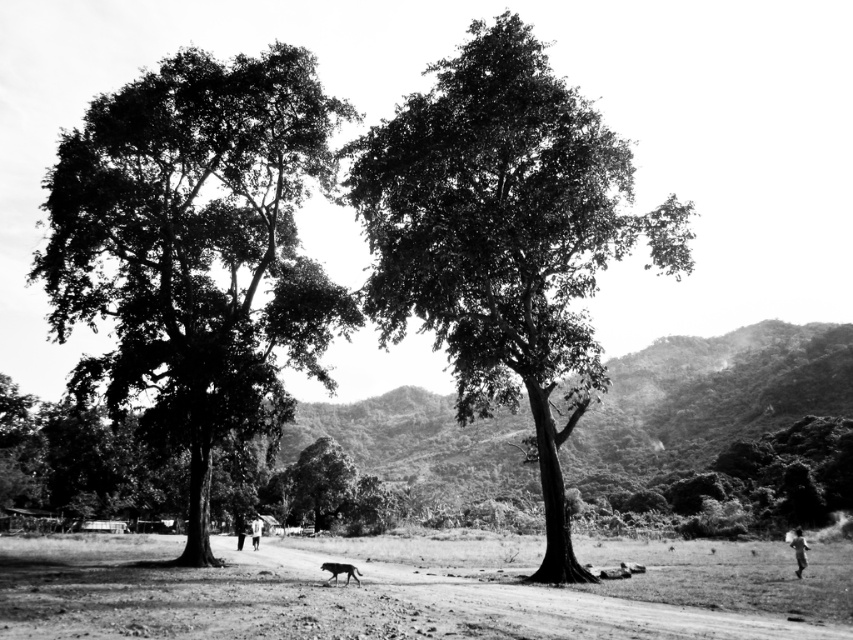
In the scene shown: You are standing at the center of the image and want to walk to the dirt field at lower center. In which direction should you move?

You should move downward because the dirt field at lower center is located below the center point of the image.

Based on the coordinates provided, which object corresponds to the point at (196, 250) in the image?

The point at (196, 250) corresponds to the dark green leafy tree at left.

You are a photographer standing at the dirt path between the two trees. You want to take a picture of the dark skin human at lower right without the dark green leafy tree at left blocking the view. Is it possible?

The dark green leafy tree at left is above the dark skin human at lower right, so it will not block the view. You can take the picture without any obstruction.